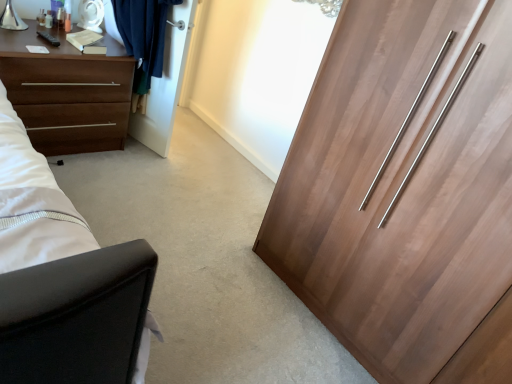
Question: Could you tell me if wooden wardrobe at right is turned towards white glossy door at upper center?

Choices:
 (A) yes
 (B) no

Answer: (B)

Question: Is wooden wardrobe at right facing away from white glossy door at upper center?

Choices:
 (A) no
 (B) yes

Answer: (A)

Question: Is the depth of wooden wardrobe at right greater than that of white glossy door at upper center?

Choices:
 (A) yes
 (B) no

Answer: (B)

Question: Does wooden wardrobe at right have a smaller size compared to white glossy door at upper center?

Choices:
 (A) no
 (B) yes

Answer: (A)

Question: Is wooden wardrobe at right to the left of white glossy door at upper center from the viewer's perspective?

Choices:
 (A) no
 (B) yes

Answer: (A)

Question: Is white glossy door at upper center to the left or to the right of wooden wardrobe at right in the image?

Choices:
 (A) right
 (B) left

Answer: (B)

Question: Would you say white glossy door at upper center is inside or outside wooden wardrobe at right?

Choices:
 (A) outside
 (B) inside

Answer: (A)

Question: From their relative heights in the image, would you say white glossy door at upper center is taller or shorter than wooden wardrobe at right?

Choices:
 (A) short
 (B) tall

Answer: (A)

Question: Is point (160, 130) closer or farther from the camera than point (315, 187)?

Choices:
 (A) farther
 (B) closer

Answer: (A)

Question: Considering the positions of brown matte chest of drawers at left and wooden wardrobe at right in the image, is brown matte chest of drawers at left taller or shorter than wooden wardrobe at right?

Choices:
 (A) tall
 (B) short

Answer: (B)

Question: Relative to wooden wardrobe at right, is brown matte chest of drawers at left in front or behind?

Choices:
 (A) front
 (B) behind

Answer: (B)

Question: Is point (84, 56) closer or farther from the camera than point (420, 162)?

Choices:
 (A) farther
 (B) closer

Answer: (A)

Question: Considering the positions of brown matte chest of drawers at left and wooden wardrobe at right in the image, is brown matte chest of drawers at left wider or thinner than wooden wardrobe at right?

Choices:
 (A) thin
 (B) wide

Answer: (A)

Question: Considering their positions, is brown matte chest of drawers at left located in front of or behind white glossy door at upper center?

Choices:
 (A) front
 (B) behind

Answer: (A)

Question: In terms of width, does brown matte chest of drawers at left look wider or thinner when compared to white glossy door at upper center?

Choices:
 (A) wide
 (B) thin

Answer: (A)